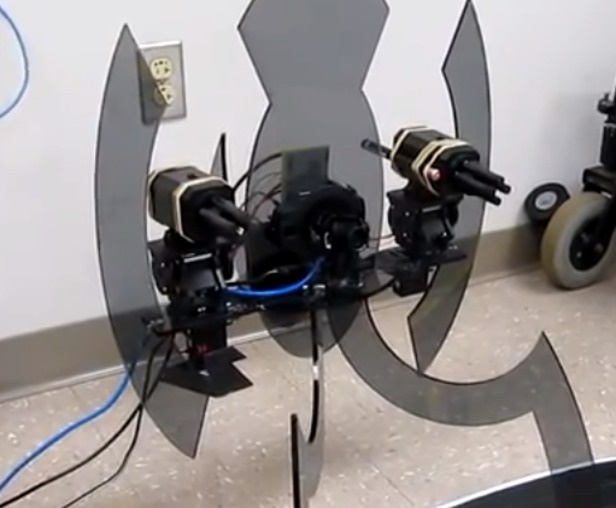
Where is `empty space on floor underneath camera device`? The image size is (616, 508). empty space on floor underneath camera device is located at coordinates (402, 449).